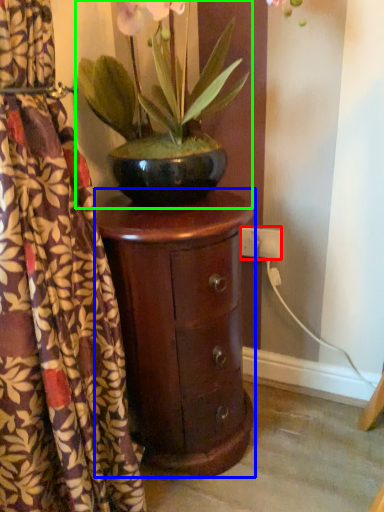
Question: Considering the real-world distances, which object is farthest from electric outlet (highlighted by a red box)? nightstand (highlighted by a blue box) or houseplant (highlighted by a green box)?

Choices:
 (A) nightstand
 (B) houseplant

Answer: (B)